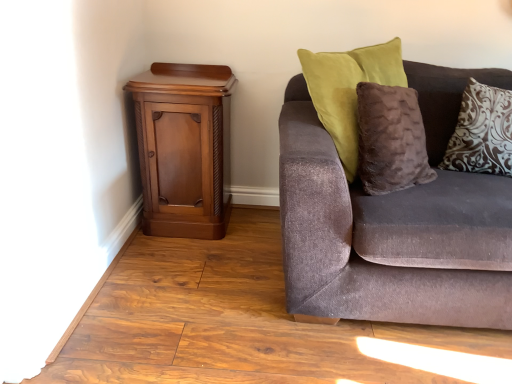
Measure the distance between point (x=176, y=124) and camera.

Point (x=176, y=124) is 1.78 meters from camera.

The image size is (512, 384). What are the coordinates of `mahogany wood cabinet at left` in the screenshot? It's located at (181, 148).

The width and height of the screenshot is (512, 384). What do you see at coordinates (393, 215) in the screenshot?
I see `velvet brown couch at right` at bounding box center [393, 215].

Identify the location of mahogany wood cabinet at left. The image size is (512, 384). (181, 148).

Based on the photo, from the image's perspective, is mahogany wood cabinet at left under brown damask pillow at upper right?

Yes.

Looking at this image, is mahogany wood cabinet at left taller or shorter than brown damask pillow at upper right?

mahogany wood cabinet at left is taller than brown damask pillow at upper right.

Between mahogany wood cabinet at left and brown damask pillow at upper right, which one is positioned behind?

mahogany wood cabinet at left is more distant.

Is mahogany wood cabinet at left looking in the opposite direction of brown damask pillow at upper right?

That's not correct — mahogany wood cabinet at left is not looking away from brown damask pillow at upper right.

Can you confirm if brown damask pillow at upper right is shorter than velvet brown couch at right?

Yes.

Considering the sizes of objects brown damask pillow at upper right and velvet brown couch at right in the image provided, who is bigger, brown damask pillow at upper right or velvet brown couch at right?

velvet brown couch at right.

Considering the points (456, 131) and (431, 303), which point is behind, point (456, 131) or point (431, 303)?

The point (456, 131) is more distant.

Is brown damask pillow at upper right oriented towards mahogany wood cabinet at left?

No, brown damask pillow at upper right is not facing towards mahogany wood cabinet at left.

From a real-world perspective, who is located higher, brown damask pillow at upper right or mahogany wood cabinet at left?

brown damask pillow at upper right is physically above.

Is brown damask pillow at upper right taller or shorter than mahogany wood cabinet at left?

In the image, brown damask pillow at upper right appears to be shorter than mahogany wood cabinet at left.

Considering the relative sizes of brown damask pillow at upper right and mahogany wood cabinet at left in the image provided, is brown damask pillow at upper right wider than mahogany wood cabinet at left?

In fact, brown damask pillow at upper right might be narrower than mahogany wood cabinet at left.

Would you say mahogany wood cabinet at left is a long distance from velvet brown couch at right?

That's not correct — mahogany wood cabinet at left is a little close to velvet brown couch at right.

In the image, is mahogany wood cabinet at left positioned in front of or behind velvet brown couch at right?

mahogany wood cabinet at left is positioned farther from the viewer than velvet brown couch at right.

Could you tell me if mahogany wood cabinet at left is turned towards velvet brown couch at right?

No, mahogany wood cabinet at left is not aimed at velvet brown couch at right.

Can you confirm if mahogany wood cabinet at left is positioned to the left of velvet brown couch at right?

Yes.

Can you confirm if velvet brown couch at right is bigger than mahogany wood cabinet at left?

Yes.

Is velvet brown couch at right with mahogany wood cabinet at left?

No, velvet brown couch at right is not touching mahogany wood cabinet at left.

Could you tell me if velvet brown couch at right is facing mahogany wood cabinet at left?

No, velvet brown couch at right is not turned towards mahogany wood cabinet at left.

Can you tell me how much velvet brown couch at right and mahogany wood cabinet at left differ in facing direction?

0.331 degrees.

From a real-world perspective, is velvet brown couch at right below brown damask pillow at upper right?

Correct, in the physical world, velvet brown couch at right is lower than brown damask pillow at upper right.

Is point (344, 192) less distant than point (477, 121)?

That is True.

Considering the sizes of velvet brown couch at right and brown damask pillow at upper right in the image, is velvet brown couch at right wider or thinner than brown damask pillow at upper right?

Clearly, velvet brown couch at right has more width compared to brown damask pillow at upper right.

Does velvet brown couch at right turn towards brown damask pillow at upper right?

Yes, velvet brown couch at right is oriented towards brown damask pillow at upper right.

Image resolution: width=512 pixels, height=384 pixels. In order to click on pillow above the mahogany wood cabinet at left (from a real-world perspective) in this screenshot , I will do `click(482, 132)`.

Locate an element on the screen. pillow behind the velvet brown couch at right is located at coordinates (482, 132).

Looking at the image, which one is located further to mahogany wood cabinet at left, brown damask pillow at upper right or velvet brown couch at right?

Based on the image, brown damask pillow at upper right appears to be further to mahogany wood cabinet at left.

Based on their spatial positions, is mahogany wood cabinet at left or brown damask pillow at upper right closer to velvet brown couch at right?

brown damask pillow at upper right is positioned closer to the anchor velvet brown couch at right.

Estimate the real-world distances between objects in this image. Which object is further from velvet brown couch at right, brown damask pillow at upper right or mahogany wood cabinet at left?

mahogany wood cabinet at left lies further to velvet brown couch at right than the other object.

When comparing their distances from brown damask pillow at upper right, does mahogany wood cabinet at left or velvet brown couch at right seem closer?

velvet brown couch at right.

From the image, which object appears to be farther from mahogany wood cabinet at left, velvet brown couch at right or brown damask pillow at upper right?

brown damask pillow at upper right is further to mahogany wood cabinet at left.

Looking at the image, which one is located closer to brown damask pillow at upper right, velvet brown couch at right or mahogany wood cabinet at left?

velvet brown couch at right lies closer to brown damask pillow at upper right than the other object.

The image size is (512, 384). Identify the location of studio couch between mahogany wood cabinet at left and brown damask pillow at upper right. pos(393,215).